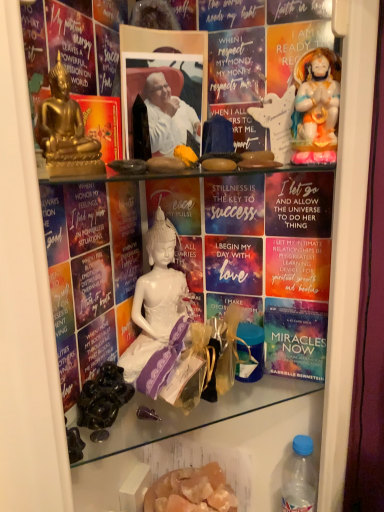
Question: Is black glossy grapes at lower left, acting as the second food starting from the right, looking in the opposite direction of translucent orange crystals at lower center, marked as the second food in a front-to-back arrangement?

Choices:
 (A) no
 (B) yes

Answer: (A)

Question: Can you confirm if black glossy grapes at lower left, the 1th food positioned from the top, is bigger than translucent orange crystals at lower center, which ranks as the first food in right-to-left order?

Choices:
 (A) yes
 (B) no

Answer: (B)

Question: Considering the relative sizes of black glossy grapes at lower left, the 1th food from the front, and translucent orange crystals at lower center, marked as the first food in a back-to-front arrangement, in the image provided, is black glossy grapes at lower left, the 1th food from the front, thinner than translucent orange crystals at lower center, marked as the first food in a back-to-front arrangement,?

Choices:
 (A) no
 (B) yes

Answer: (B)

Question: From a real-world perspective, is black glossy grapes at lower left, marked as the first food in a left-to-right arrangement, physically below translucent orange crystals at lower center, marked as the second food in a front-to-back arrangement?

Choices:
 (A) yes
 (B) no

Answer: (B)

Question: Is black glossy grapes at lower left, the second food when ordered from back to front, further to camera compared to translucent orange crystals at lower center, which ranks as the first food in right-to-left order?

Choices:
 (A) no
 (B) yes

Answer: (A)

Question: Considering the positions of purple satin dress at center and white porcelain statue at upper right in the image, is purple satin dress at center wider or thinner than white porcelain statue at upper right?

Choices:
 (A) thin
 (B) wide

Answer: (B)

Question: Is purple satin dress at center taller or shorter than white porcelain statue at upper right?

Choices:
 (A) short
 (B) tall

Answer: (B)

Question: Considering their positions, is purple satin dress at center located in front of or behind white porcelain statue at upper right?

Choices:
 (A) front
 (B) behind

Answer: (A)

Question: Is purple satin dress at center spatially inside white porcelain statue at upper right, or outside of it?

Choices:
 (A) inside
 (B) outside

Answer: (B)

Question: In terms of size, does white glossy statue at upper right, acting as the second person starting from the left, appear bigger or smaller than blue plastic bottle at lower right?

Choices:
 (A) big
 (B) small

Answer: (B)

Question: Is white glossy statue at upper right, the first person in the back-to-front sequence, in front of or behind blue plastic bottle at lower right in the image?

Choices:
 (A) front
 (B) behind

Answer: (A)

Question: Looking at their shapes, would you say white glossy statue at upper right, acting as the second person starting from the left, is wider or thinner than blue plastic bottle at lower right?

Choices:
 (A) thin
 (B) wide

Answer: (A)

Question: From the image's perspective, relative to blue plastic bottle at lower right, is white glossy statue at upper right, arranged as the second person when viewed from the front, above or below?

Choices:
 (A) above
 (B) below

Answer: (A)

Question: In the image, is purple satin dress at center on the left side or the right side of translucent orange crystals at lower center, marked as the second food in a front-to-back arrangement?

Choices:
 (A) left
 (B) right

Answer: (A)

Question: In terms of size, does purple satin dress at center appear bigger or smaller than translucent orange crystals at lower center, which ranks as the first food in bottom-to-top order?

Choices:
 (A) small
 (B) big

Answer: (A)